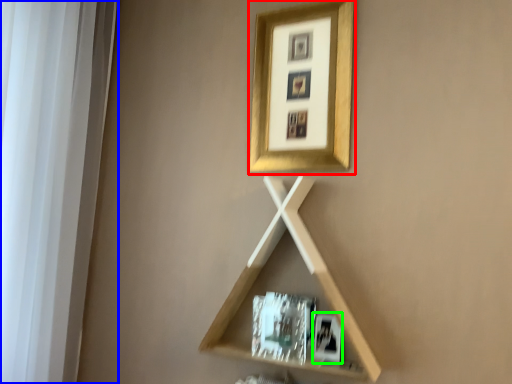
Question: Which is farther away from picture frame (highlighted by a red box)? window frame (highlighted by a blue box) or picture frame (highlighted by a green box)?

Choices:
 (A) window frame
 (B) picture frame

Answer: (A)